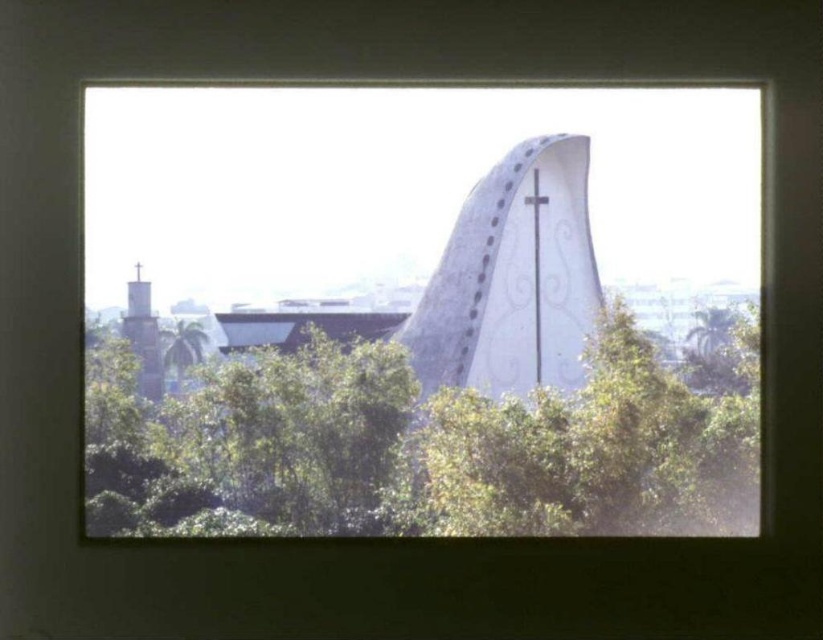
Question: Considering the relative positions of smooth gray stone spire at left and green leafy tree at lower left in the image provided, where is smooth gray stone spire at left located with respect to green leafy tree at lower left?

Choices:
 (A) left
 (B) right

Answer: (A)

Question: Which object appears closest to the camera in this image?

Choices:
 (A) smooth gray stone spire at left
 (B) green leafy tree at lower left
 (C) green leafy tree at center

Answer: (C)

Question: Which of the following is the farthest from the observer?

Choices:
 (A) (194, 346)
 (B) (198, 384)
 (C) (154, 365)

Answer: (B)

Question: From the image, what is the correct spatial relationship of green leafy tree at center in relation to green leafy tree at lower left?

Choices:
 (A) left
 (B) right

Answer: (B)

Question: Considering the relative positions of smooth gray stone spire at left and green leafy tree at lower left in the image provided, where is smooth gray stone spire at left located with respect to green leafy tree at lower left?

Choices:
 (A) right
 (B) left

Answer: (B)

Question: Which is nearer to the green leafy tree at lower left?

Choices:
 (A) green leafy tree at center
 (B) smooth gray stone spire at left

Answer: (B)